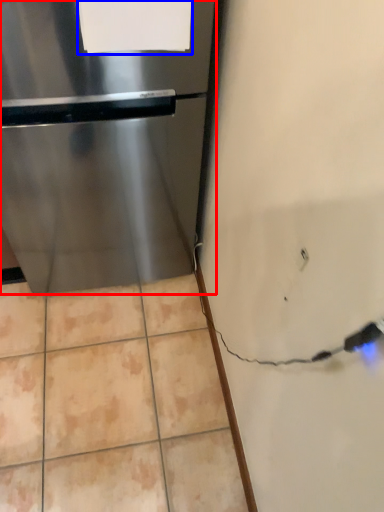
Question: Among these objects, which one is nearest to the camera, refrigerator (highlighted by a red box) or paper (highlighted by a blue box)?

Choices:
 (A) refrigerator
 (B) paper

Answer: (B)